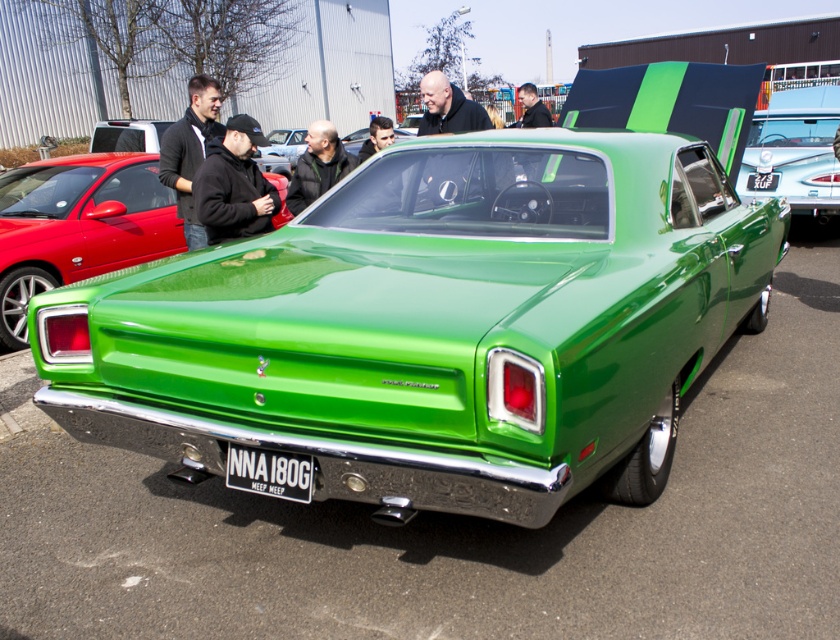
You are a photographer at a car show. You need to capture both the green glossy sedan at center and the green glossy car at center in one frame. Which one will appear smaller in the photo?

The green glossy sedan at center will appear smaller in the photo because it is not as tall as the green glossy car at center.

You are a photographer at the car show and want to take a picture of the black matte jacket at upper center and the smooth black hair at center. Which object should you focus on first if you want to capture both in the same frame without moving the camera?

The black matte jacket at upper center is shorter than the smooth black hair at center, so you should focus on the black matte jacket at upper center first to ensure both are in focus.